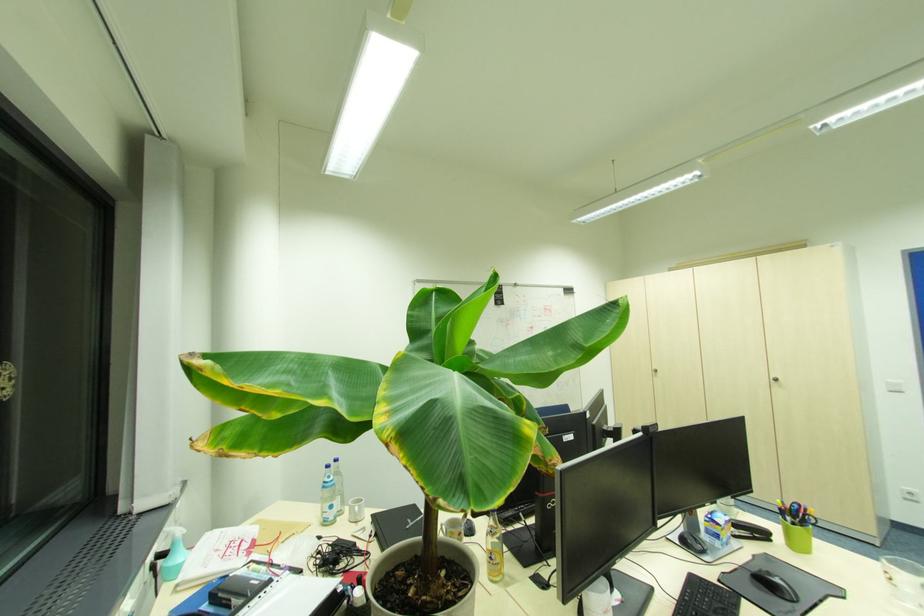
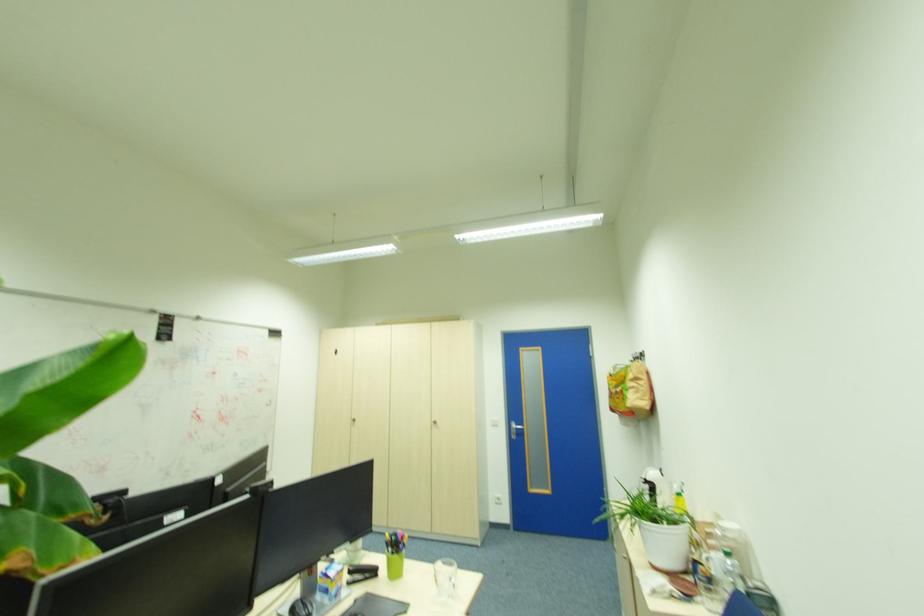
Question: The camera is either moving clockwise (left) or counter-clockwise (right) around the object. The first image is from the beginning of the video and the second image is from the end. Is the camera moving left or right when shooting the video?

Choices:
 (A) Left
 (B) Right

Answer: (A)